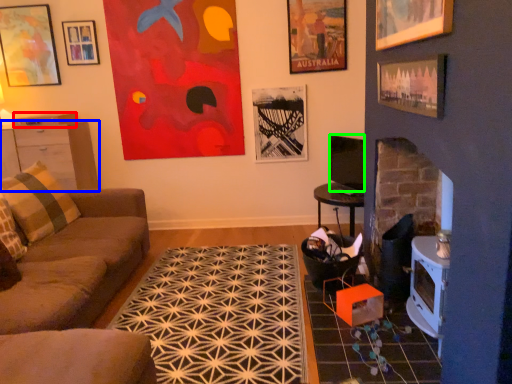
Question: Based on their relative distances, which object is farther from drawer (highlighted by a red box)? Choose from cabinetry (highlighted by a blue box) and television (highlighted by a green box).

Choices:
 (A) cabinetry
 (B) television

Answer: (B)